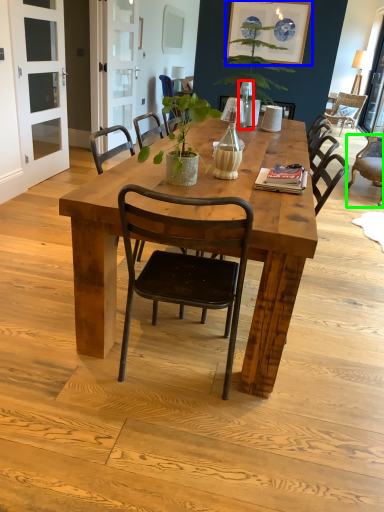
Question: Considering the real-world distances, which object is farthest from lamp (highlighted by a red box)? painting (highlighted by a blue box) or chair (highlighted by a green box)?

Choices:
 (A) painting
 (B) chair

Answer: (B)